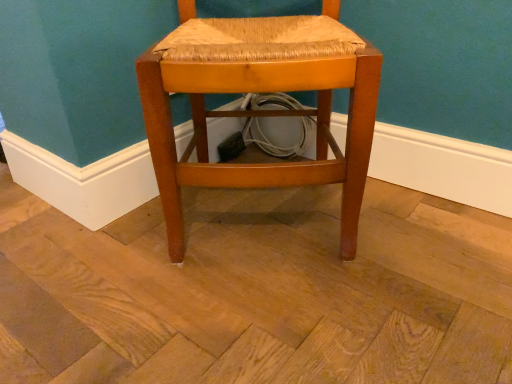
I want to click on free spot to the right of matte wood chair at center, so click(x=422, y=233).